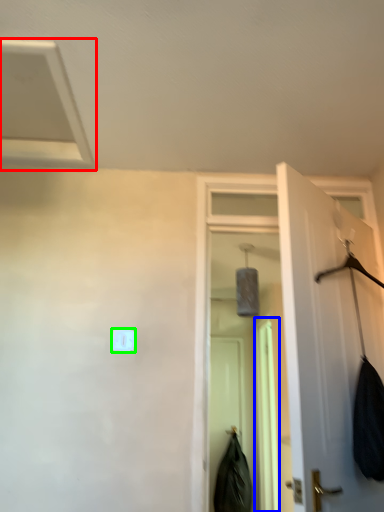
Question: Which object is positioned farthest from exhaust hood (highlighted by a red box)? Select from screen door (highlighted by a blue box) and light switch (highlighted by a green box).

Choices:
 (A) screen door
 (B) light switch

Answer: (A)